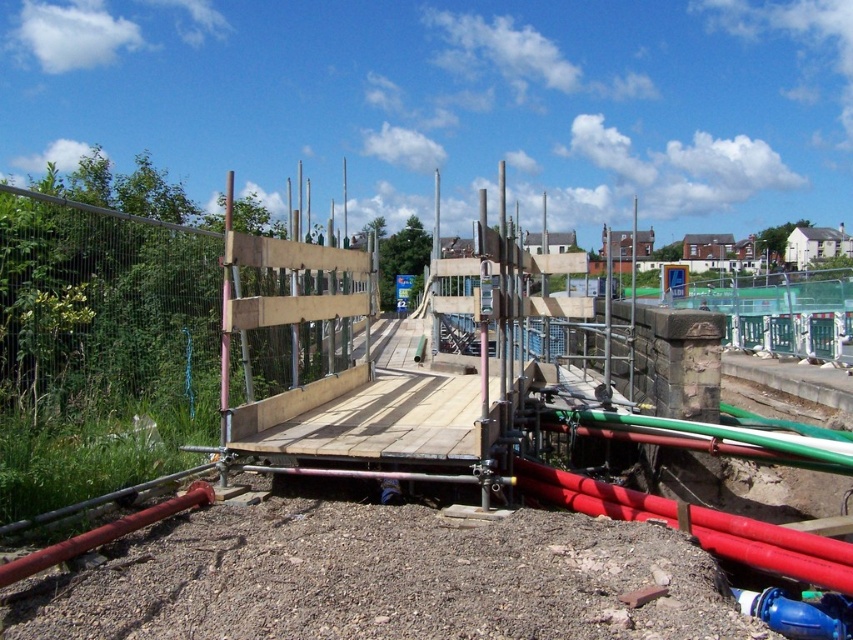
Between wooden platform at center and blue rubber hose at lower right, which one appears on the left side from the viewer's perspective?

Positioned to the left is wooden platform at center.

The width and height of the screenshot is (853, 640). Describe the element at coordinates (405, 406) in the screenshot. I see `wooden platform at center` at that location.

Locate an element on the screen. wooden platform at center is located at coordinates (405, 406).